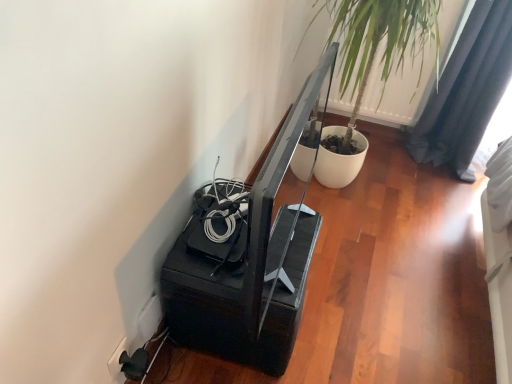
Locate an element on the screen. free region on the left part of dark gray fabric curtain at upper right is located at coordinates (386, 160).